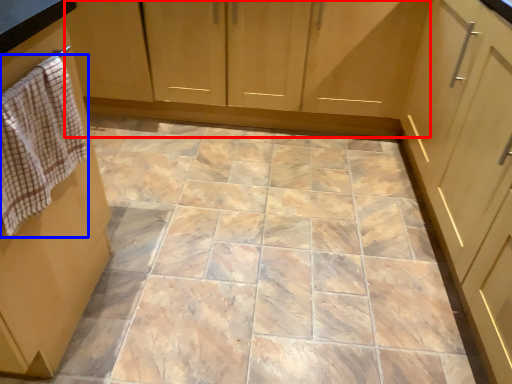
Question: Which point is closer to the camera, cabinetry (highlighted by a red box) or hand towel (highlighted by a blue box)?

Choices:
 (A) cabinetry
 (B) hand towel

Answer: (B)